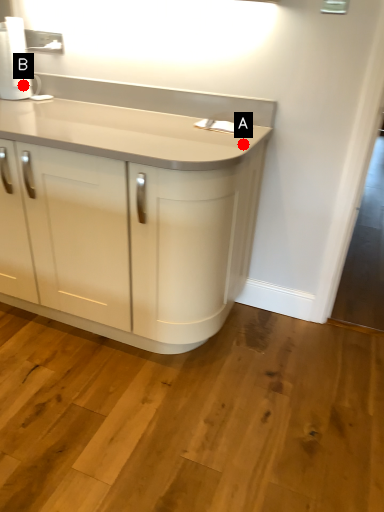
Question: Two points are circled on the image, labeled by A and B beside each circle. Which point appears farthest from the camera in this image?

Choices:
 (A) A is further
 (B) B is further

Answer: (B)